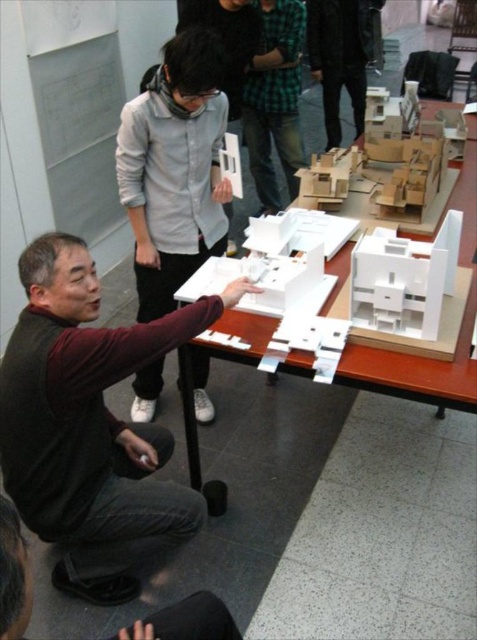
Is point (278, 83) more distant than point (369, 35)?

No, (278, 83) is closer to viewer.

What do you see at coordinates (275, 99) in the screenshot? I see `green plaid shirt at upper center` at bounding box center [275, 99].

What do you see at coordinates (275, 99) in the screenshot? This screenshot has height=640, width=477. I see `green plaid shirt at upper center` at bounding box center [275, 99].

Locate an element on the screen. This screenshot has width=477, height=640. green plaid shirt at upper center is located at coordinates (275, 99).

Between white cardboard table at center and black leather shoes at lower center, which one is positioned lower?

black leather shoes at lower center is below.

Does white cardboard table at center have a larger size compared to black leather shoes at lower center?

Indeed, white cardboard table at center has a larger size compared to black leather shoes at lower center.

Is point (458, 196) more distant than point (178, 634)?

Yes, point (458, 196) is behind point (178, 634).

Identify the location of white cardboard table at center. This screenshot has width=477, height=640. (458, 268).

Is dark brown sweater at lower left bigger than white matte model at center?

Actually, dark brown sweater at lower left might be smaller than white matte model at center.

From the picture: Is dark brown sweater at lower left smaller than white matte model at center?

Yes, dark brown sweater at lower left is smaller than white matte model at center.

Between point (114, 545) and point (163, 294), which one is positioned in front?

Point (114, 545) is more forward.

Locate an element on the screen. Image resolution: width=477 pixels, height=640 pixels. dark brown sweater at lower left is located at coordinates (91, 426).